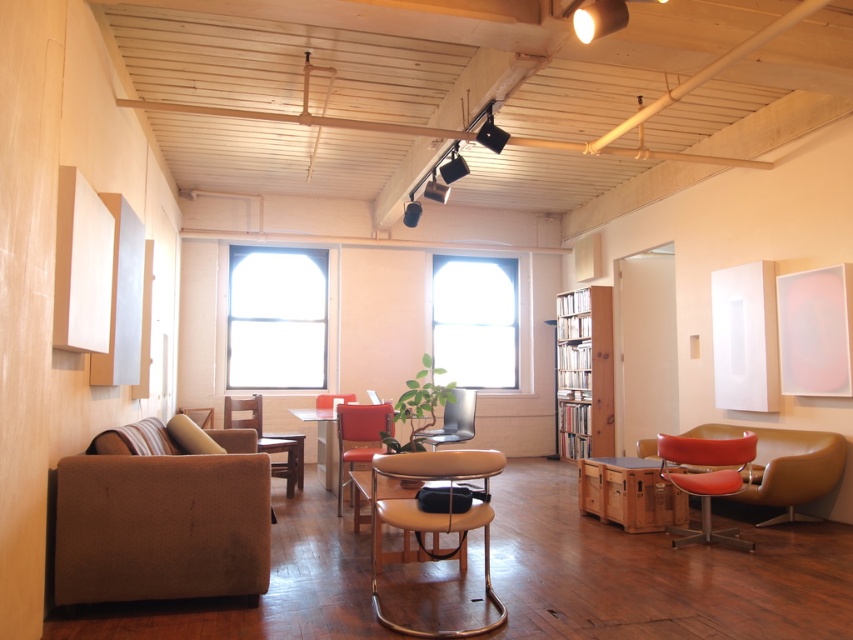
Which is below, clear glass window at center or matte glass table at center?

matte glass table at center is lower down.

Locate an element on the screen. The width and height of the screenshot is (853, 640). clear glass window at center is located at coordinates (276, 317).

What do you see at coordinates (474, 321) in the screenshot? I see `transparent glass window at center` at bounding box center [474, 321].

Identify the location of transparent glass window at center. (474, 321).

Where is `clear glass window at center`? The height and width of the screenshot is (640, 853). clear glass window at center is located at coordinates (276, 317).

Can you confirm if clear glass window at center is smaller than matte orange swivel chair at lower right?

Actually, clear glass window at center might be larger than matte orange swivel chair at lower right.

Does point (287, 339) lie behind point (712, 465)?

Yes, it is.

The image size is (853, 640). In order to click on clear glass window at center in this screenshot , I will do `click(276, 317)`.